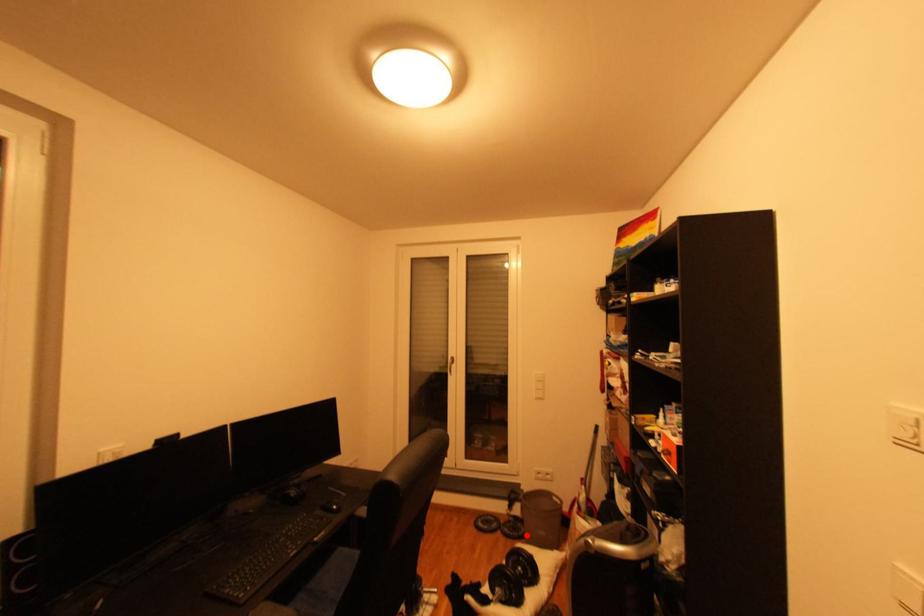
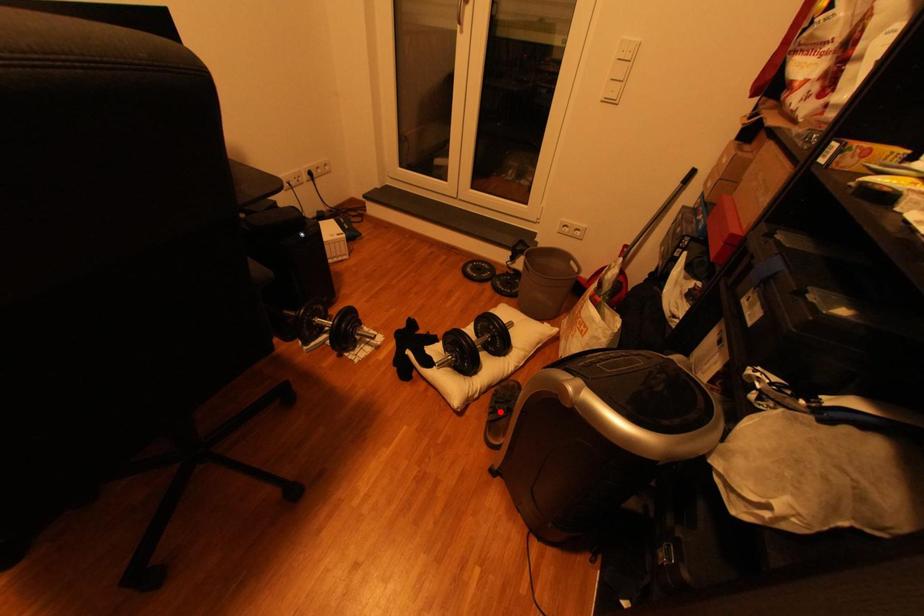
I am providing you with two images of the same scene from different viewpoints. A red point is marked on the first image and another point is marked on the second image. Does the point marked in image1 correspond to the same location as the one in image2?

No